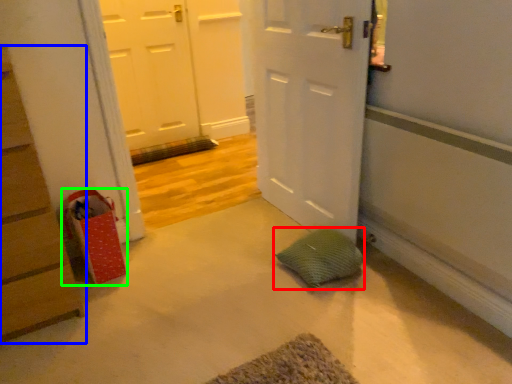
Question: Considering the real-world distances, which object is farthest from pillow (highlighted by a red box)? chest of drawers (highlighted by a blue box) or shopping bag (highlighted by a green box)?

Choices:
 (A) chest of drawers
 (B) shopping bag

Answer: (A)